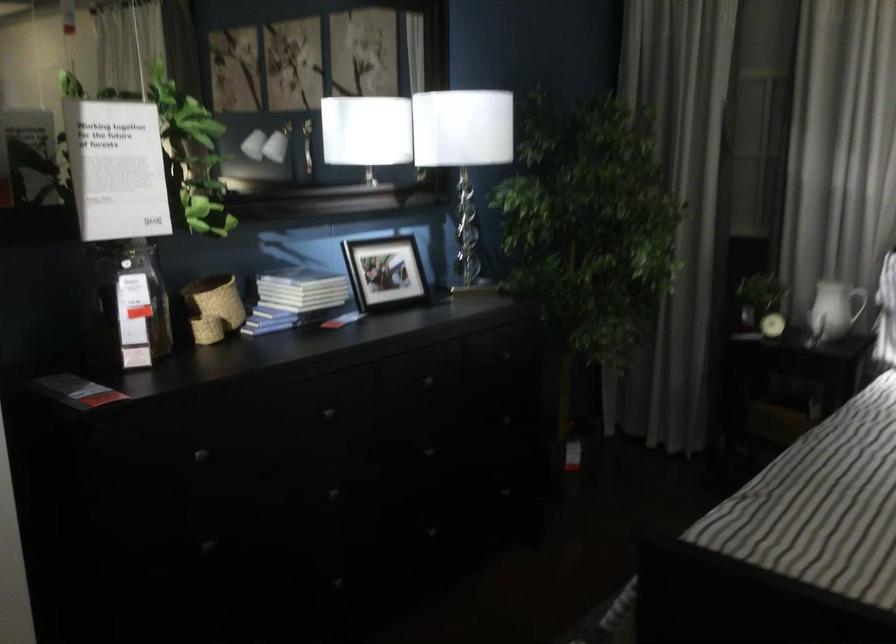
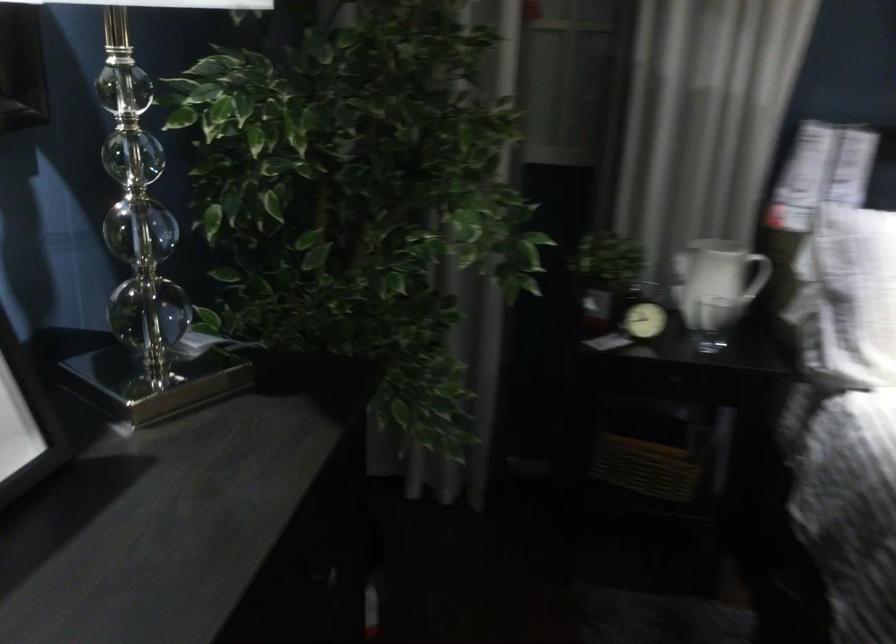
Find the pixel in the second image that matches pixel 760 285 in the first image.

(605, 275)